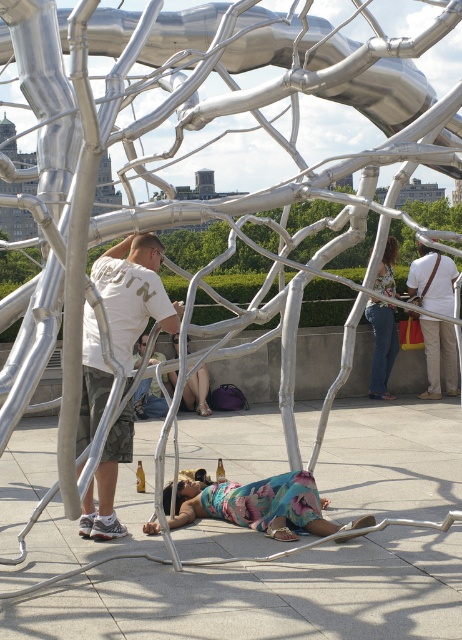
Measure the distance between point (x=144, y=292) and camera.

Point (x=144, y=292) is 131.81 feet away from camera.

Does white cotton t-shirt at center appear under matte white shirt at center?

No.

Measure the distance between white cotton t-shirt at center and camera.

white cotton t-shirt at center is 35.60 meters from camera.

I want to click on white cotton t-shirt at center, so click(x=133, y=292).

Which is in front, point (231, 486) or point (163, 412)?

Point (231, 486) is more forward.

Which is more to the left, multicolored fabric at center or matte white shirt at center?

Positioned to the left is matte white shirt at center.

Is point (287, 508) farther from viewer compared to point (145, 339)?

No, it is in front of (145, 339).

The image size is (462, 640). I want to click on multicolored fabric at center, so 260,506.

Looking at this image, does white cotton t-shirt at center have a larger size compared to multicolored fabric at center?

Indeed, white cotton t-shirt at center has a larger size compared to multicolored fabric at center.

Identify the location of white cotton t-shirt at center. The height and width of the screenshot is (640, 462). (133, 292).